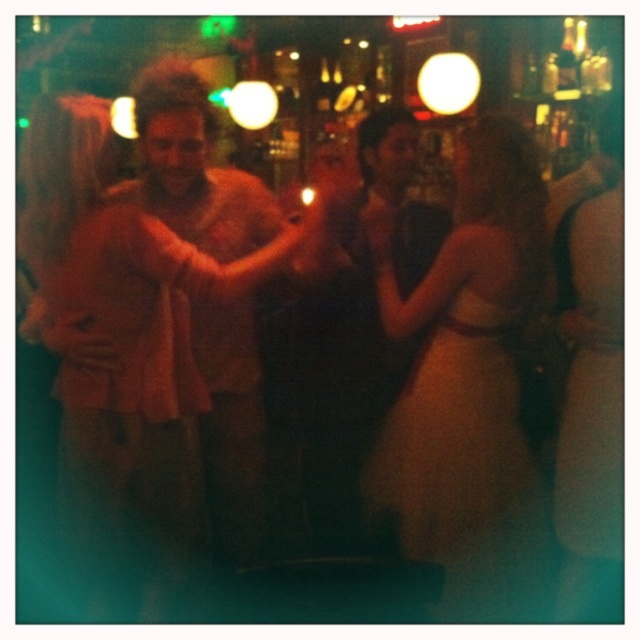
Question: Among these points, which one is farthest from the camera?

Choices:
 (A) (58, 372)
 (B) (580, 342)

Answer: (B)

Question: Which point is farther to the camera?

Choices:
 (A) matte beige dress at center
 (B) light brown leather jacket at center

Answer: (B)

Question: Can you confirm if matte beige dress at center is smaller than light brown leather jacket at center?

Choices:
 (A) yes
 (B) no

Answer: (B)

Question: Does matte beige dress at center lie behind light brown leather jacket at center?

Choices:
 (A) yes
 (B) no

Answer: (B)

Question: Does matte beige dress at center appear on the right side of silky beige dress at center?

Choices:
 (A) no
 (B) yes

Answer: (A)

Question: Which of the following is the farthest from the observer?

Choices:
 (A) light brown leather jacket at center
 (B) silky beige dress at center
 (C) matte beige dress at center

Answer: (B)